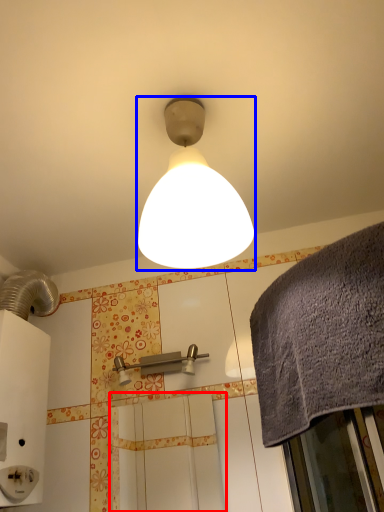
Question: Which object is further to the camera taking this photo, screen door (highlighted by a red box) or lamp (highlighted by a blue box)?

Choices:
 (A) screen door
 (B) lamp

Answer: (A)